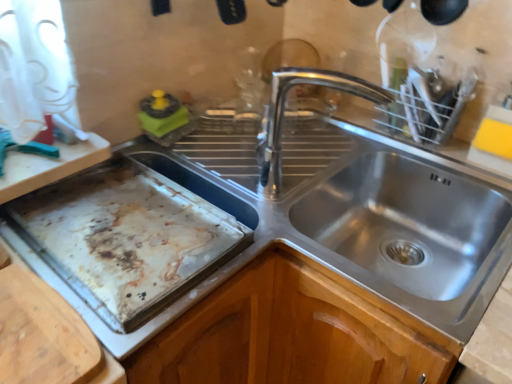
This screenshot has width=512, height=384. Identify the location of blank space situated above stained aluminum baking sheet at left (from a real-world perspective). (133, 228).